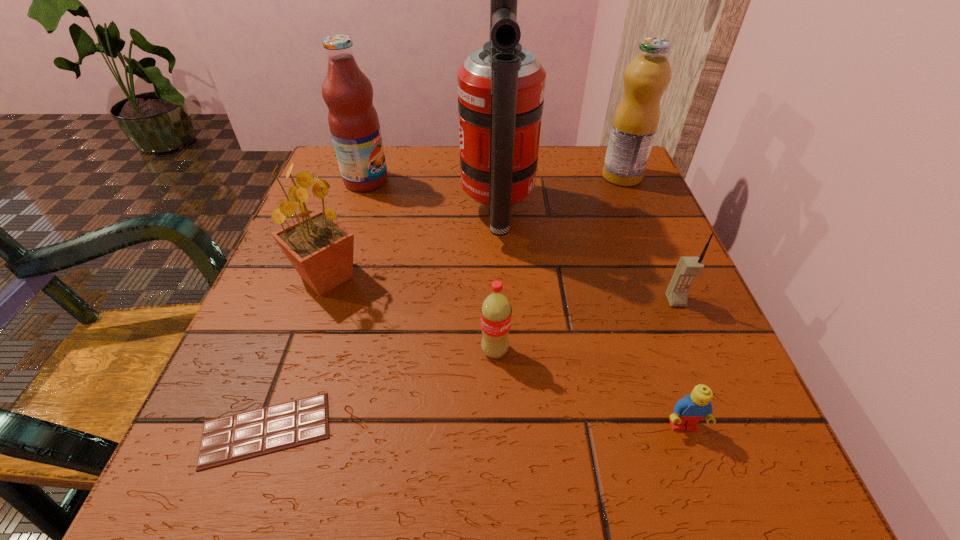
Locate an element on the screen. blank space located on the front label side of the fire extinguisher is located at coordinates (360, 213).

This screenshot has height=540, width=960. I want to click on blank space located 0.150m on the front label of the left fruit juice, so click(455, 181).

I want to click on free space located on the front label of the right fruit juice, so 489,176.

Identify the location of free point located on the front label of the right fruit juice. The height and width of the screenshot is (540, 960). (497, 176).

At what (x,y) coordinates should I click in order to perform the action: click on vacant region located on the front label of the right fruit juice. Please return your answer as a coordinate pair (x, y). This screenshot has width=960, height=540. Looking at the image, I should click on (470, 176).

Locate an element on the screen. The height and width of the screenshot is (540, 960). free space located at the front of the sunflower with flowers visible is located at coordinates (433, 277).

The height and width of the screenshot is (540, 960). In order to click on vacant space situated 0.120m on the front of the cellular telephone, where the keypad is located in this screenshot , I will do `click(705, 370)`.

Find the location of a particular element. Image resolution: width=960 pixels, height=540 pixels. blank space located on the back of the soda is located at coordinates (491, 197).

Find the location of a particular element. free space located 0.060m on the face of the Lego is located at coordinates (703, 483).

Find the location of a particular element. free space located 0.190m on the right of the chocolate bar is located at coordinates (476, 430).